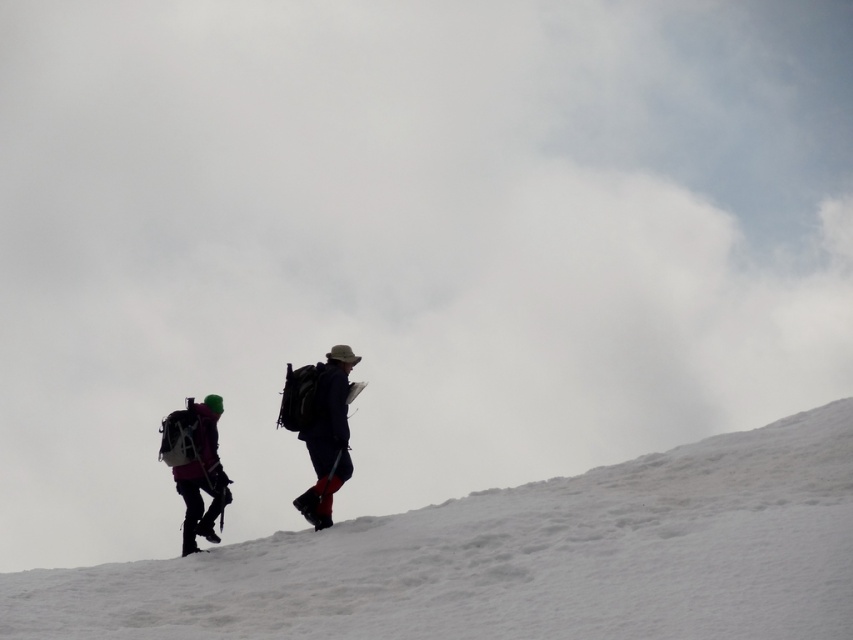
Does point (328, 408) come in front of point (190, 538)?

Yes, point (328, 408) is in front of point (190, 538).

Locate an element on the screen. matte pink jacket at center is located at coordinates (321, 426).

Which is above, white powdery snow at center or dark blue fabric backpack at center?

Positioned higher is dark blue fabric backpack at center.

Does point (302, 618) lie in front of point (316, 365)?

Yes, point (302, 618) is closer to viewer.

Is point (479, 588) in front of point (326, 364)?

Yes, point (479, 588) is closer to viewer.

The width and height of the screenshot is (853, 640). I want to click on white powdery snow at center, so click(518, 557).

Is matte pink jacket at center smaller than dark blue fabric backpack at center?

Incorrect, matte pink jacket at center is not smaller in size than dark blue fabric backpack at center.

Does matte pink jacket at center appear on the right side of dark blue fabric backpack at center?

No, matte pink jacket at center is not to the right of dark blue fabric backpack at center.

Between point (216, 476) and point (334, 486), which one is positioned in front?

Point (334, 486)

Locate an element on the screen. The image size is (853, 640). matte pink jacket at center is located at coordinates (321, 426).